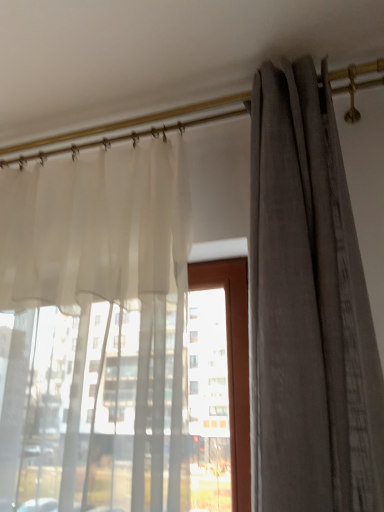
Question: From the image's perspective, is translucent white curtain at left, placed as the 2th curtain when sorted from right to left, under gray textured curtain at right, which is the 1th curtain in right-to-left order?

Choices:
 (A) yes
 (B) no

Answer: (A)

Question: Is translucent white curtain at left, placed as the 2th curtain when sorted from right to left, outside of gray textured curtain at right, arranged as the 2th curtain when viewed from the left?

Choices:
 (A) yes
 (B) no

Answer: (A)

Question: Is translucent white curtain at left, placed as the 2th curtain when sorted from right to left, to the right of gray textured curtain at right, arranged as the 2th curtain when viewed from the left, from the viewer's perspective?

Choices:
 (A) no
 (B) yes

Answer: (A)

Question: Does translucent white curtain at left, placed as the first curtain when sorted from left to right, come in front of gray textured curtain at right, arranged as the 2th curtain when viewed from the left?

Choices:
 (A) no
 (B) yes

Answer: (A)

Question: Are translucent white curtain at left, placed as the first curtain when sorted from left to right, and gray textured curtain at right, which is the 1th curtain in right-to-left order, located far from each other?

Choices:
 (A) yes
 (B) no

Answer: (B)

Question: Can you confirm if translucent white curtain at left, placed as the 2th curtain when sorted from right to left, is smaller than gray textured curtain at right, which is the 1th curtain in right-to-left order?

Choices:
 (A) yes
 (B) no

Answer: (B)

Question: Could translucent white curtain at left, placed as the 2th curtain when sorted from right to left, be considered to be inside gray textured curtain at right, which is the 1th curtain in right-to-left order?

Choices:
 (A) no
 (B) yes

Answer: (A)

Question: Considering the relative sizes of gray textured curtain at right, which is the 1th curtain in right-to-left order, and translucent white curtain at left, placed as the first curtain when sorted from left to right, in the image provided, is gray textured curtain at right, which is the 1th curtain in right-to-left order, smaller than translucent white curtain at left, placed as the first curtain when sorted from left to right,?

Choices:
 (A) no
 (B) yes

Answer: (B)

Question: Considering the relative sizes of gray textured curtain at right, arranged as the 2th curtain when viewed from the left, and translucent white curtain at left, placed as the first curtain when sorted from left to right, in the image provided, is gray textured curtain at right, arranged as the 2th curtain when viewed from the left, wider than translucent white curtain at left, placed as the first curtain when sorted from left to right,?

Choices:
 (A) yes
 (B) no

Answer: (A)

Question: From a real-world perspective, is gray textured curtain at right, arranged as the 2th curtain when viewed from the left, positioned under translucent white curtain at left, placed as the first curtain when sorted from left to right, based on gravity?

Choices:
 (A) yes
 (B) no

Answer: (B)

Question: Does gray textured curtain at right, arranged as the 2th curtain when viewed from the left, lie in front of translucent white curtain at left, placed as the 2th curtain when sorted from right to left?

Choices:
 (A) yes
 (B) no

Answer: (A)

Question: Considering the relative sizes of gray textured curtain at right, arranged as the 2th curtain when viewed from the left, and translucent white curtain at left, placed as the 2th curtain when sorted from right to left, in the image provided, is gray textured curtain at right, arranged as the 2th curtain when viewed from the left, shorter than translucent white curtain at left, placed as the 2th curtain when sorted from right to left,?

Choices:
 (A) no
 (B) yes

Answer: (A)

Question: Would you say gray textured curtain at right, which is the 1th curtain in right-to-left order, is to the left or to the right of translucent white curtain at left, placed as the 2th curtain when sorted from right to left, in the picture?

Choices:
 (A) right
 (B) left

Answer: (A)